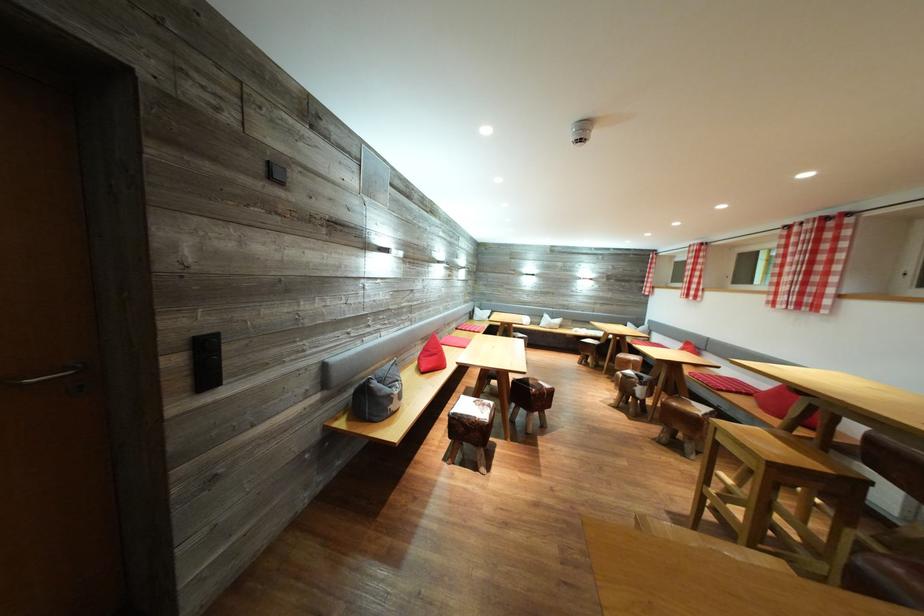
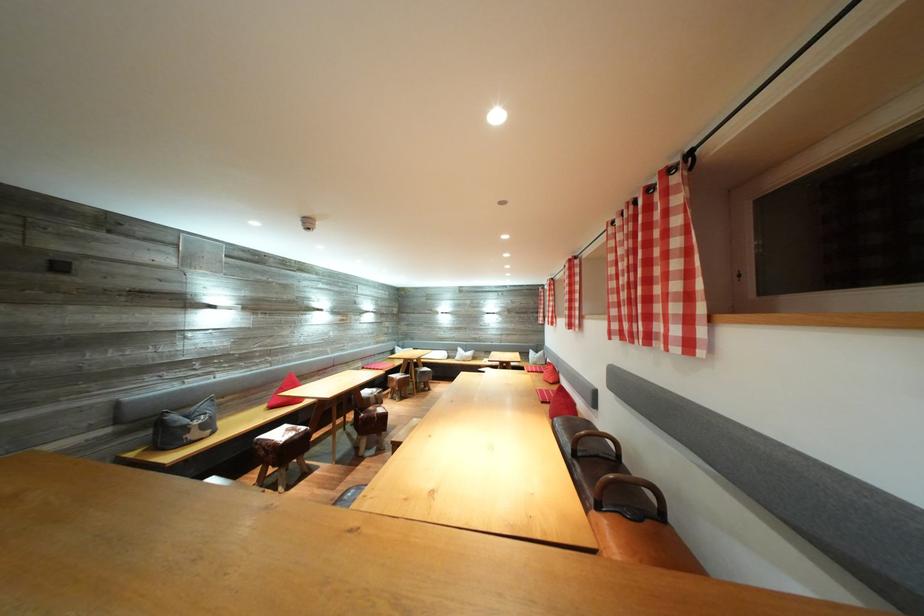
In the second image, find the point that corresponds to the point at 808,299 in the first image.

(578, 322)